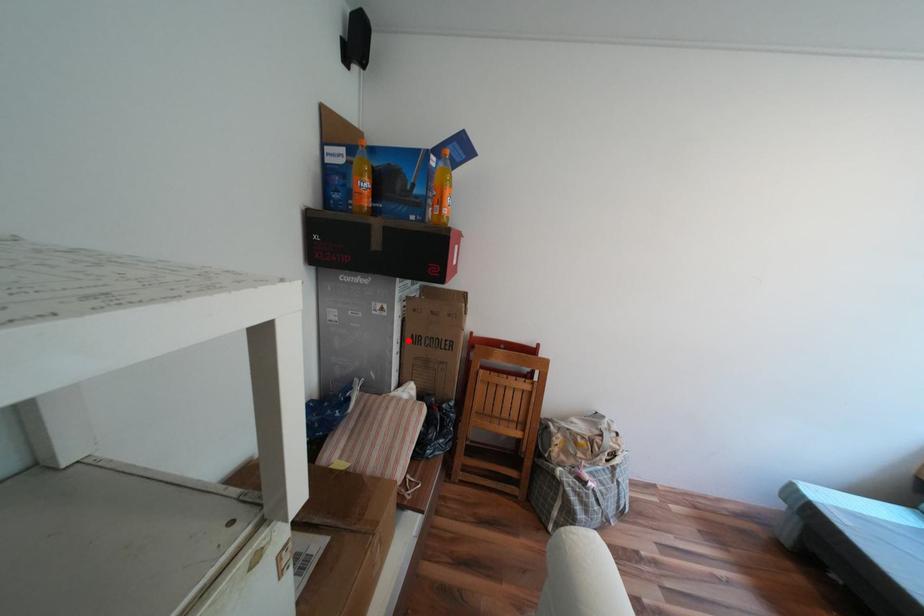
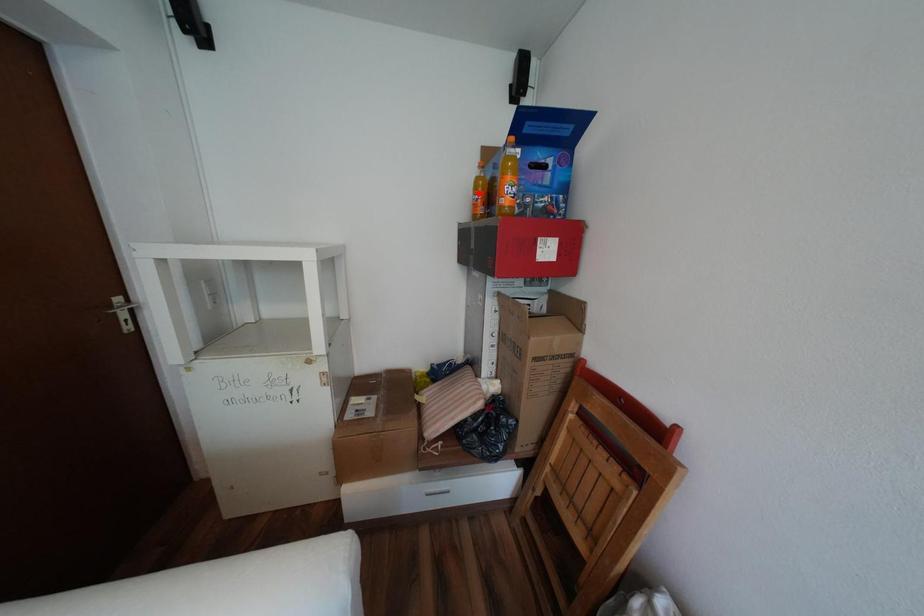
I am providing you with two images of the same scene from different viewpoints. A red point is marked on the first image and another point is marked on the second image. Does the point marked in image1 correspond to the same location as the one in image2?

No